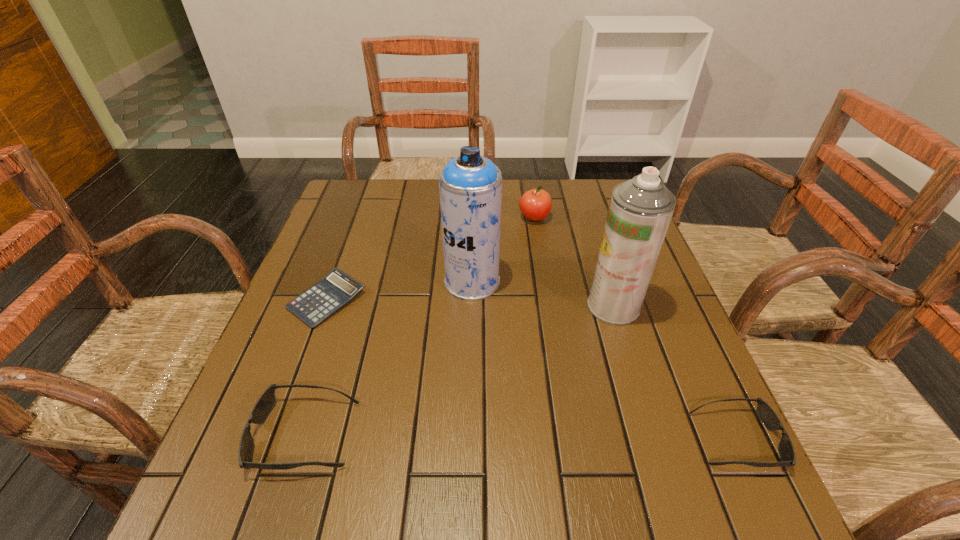
Where is `location for an additional sunglasses to make spacing equal`? location for an additional sunglasses to make spacing equal is located at coordinates (519, 437).